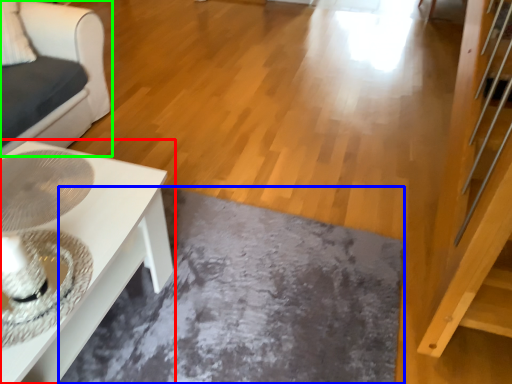
Question: Which is farther away from table (highlighted by a red box)? slate (highlighted by a blue box) or furniture (highlighted by a green box)?

Choices:
 (A) slate
 (B) furniture

Answer: (B)